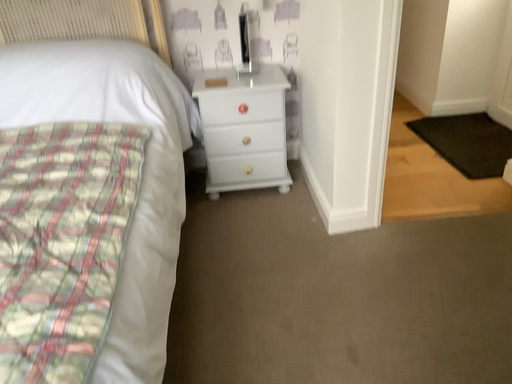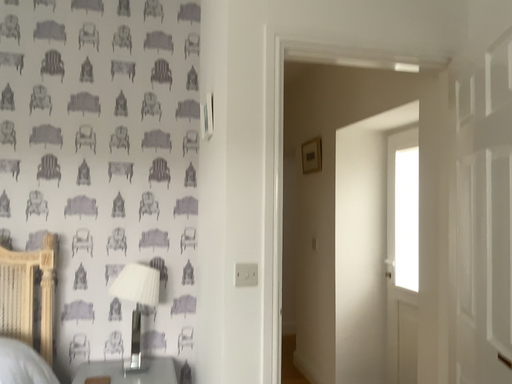
Question: How did the camera likely rotate when shooting the video?

Choices:
 (A) rotated right
 (B) rotated left

Answer: (A)